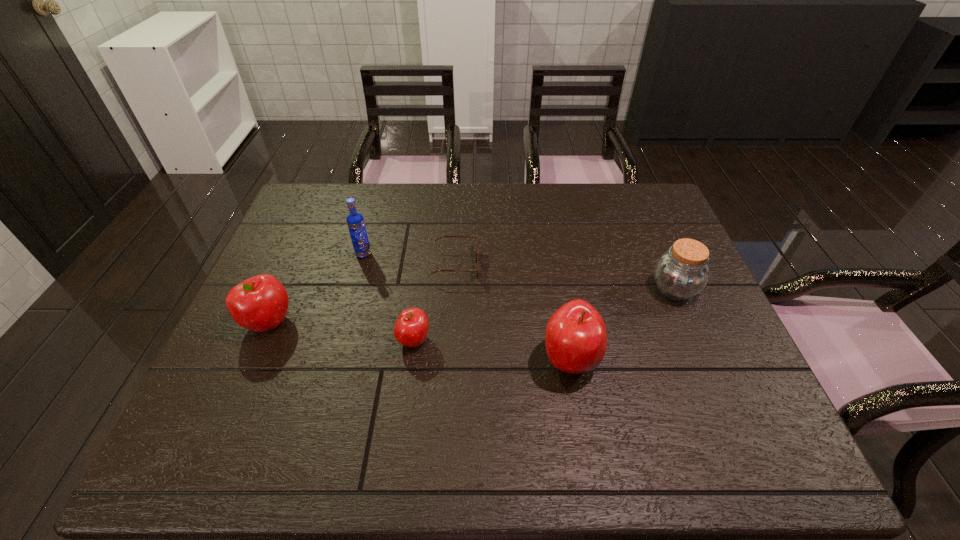
Identify the location of free location at the far left corner of the desktop. (306, 187).

In order to click on vacant space at the far right corner of the desktop in this screenshot , I will do `click(646, 198)`.

Identify the location of vacant area between the second object from left to right and the leftmost object. The width and height of the screenshot is (960, 540). (316, 288).

What are the coordinates of `free space between the spectacles and the shortest apple` in the screenshot? It's located at (435, 302).

Locate an element on the screen. empty space that is in between the leftmost object and the jar is located at coordinates 471,306.

Where is `free spot between the fifth tallest object and the leftmost object`? The height and width of the screenshot is (540, 960). free spot between the fifth tallest object and the leftmost object is located at coordinates (341, 332).

I want to click on vacant area that lies between the leftmost object and the jar, so click(471, 306).

The height and width of the screenshot is (540, 960). In order to click on vacant area between the second shortest object and the leftmost object in this screenshot , I will do `click(341, 332)`.

At what (x,y) coordinates should I click in order to perform the action: click on empty location between the shortest object and the shortest apple. Please return your answer as a coordinate pair (x, y). Looking at the image, I should click on (435, 302).

I want to click on vacant area that lies between the fifth object from right to left and the shortest apple, so click(x=389, y=297).